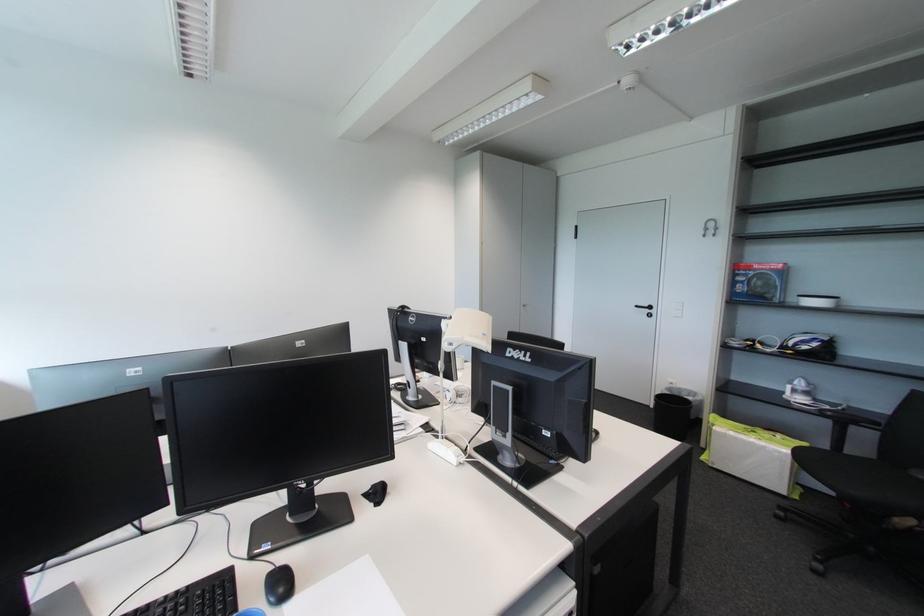
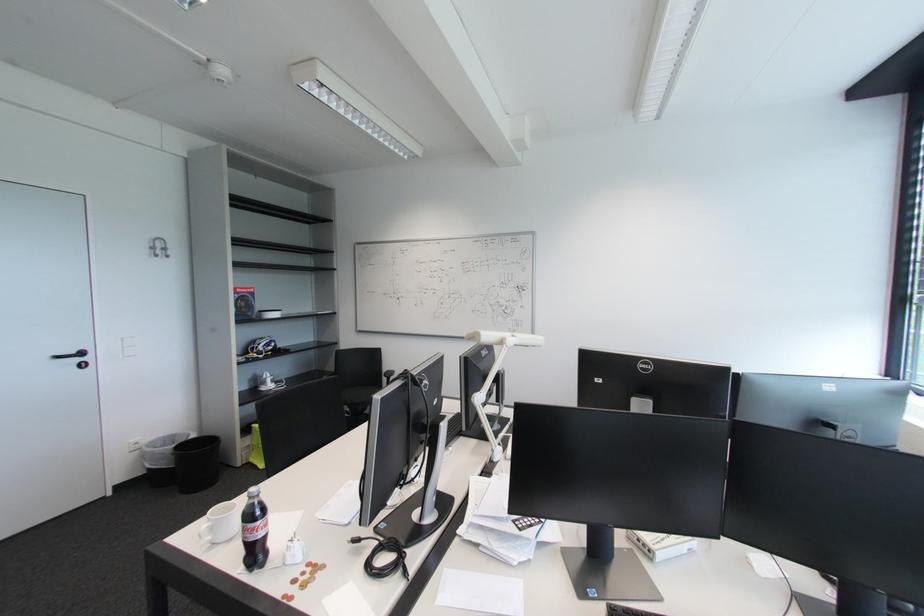
In the second image, find the point that corresponds to [653,312] in the first image.

(83, 361)